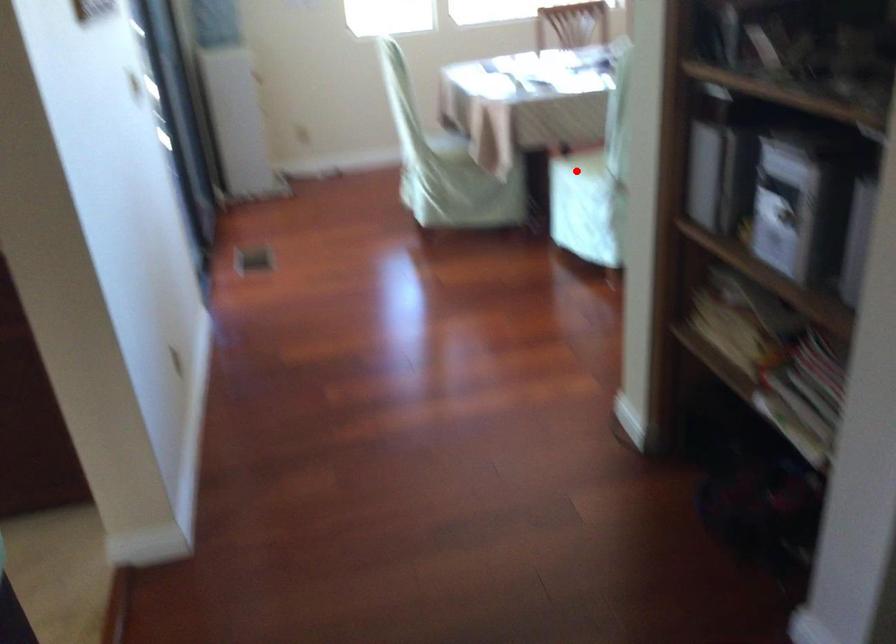
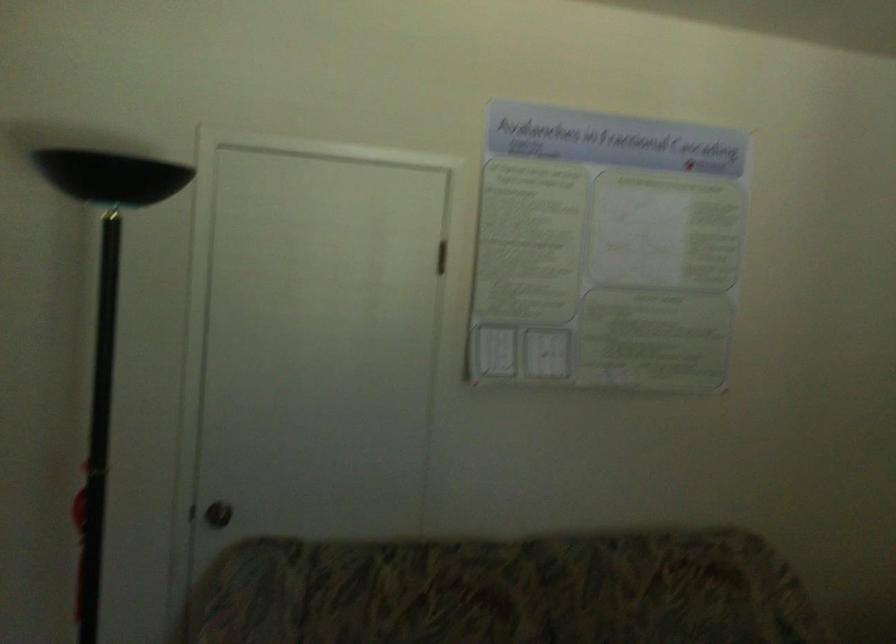
Question: I am providing you with two images of the same scene from different viewpoints. A red point is marked on the first image. Is the red point's position out of view in image 2?

Choices:
 (A) Yes
 (B) No

Answer: (A)